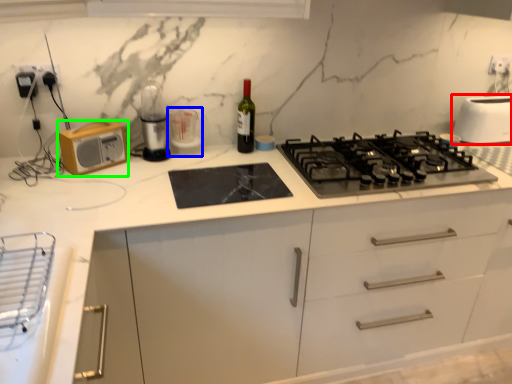
Question: Based on their relative distances, which object is nearer to toaster (highlighted by a red box)? Choose from appliance (highlighted by a blue box) and kitchen appliance (highlighted by a green box).

Choices:
 (A) appliance
 (B) kitchen appliance

Answer: (A)